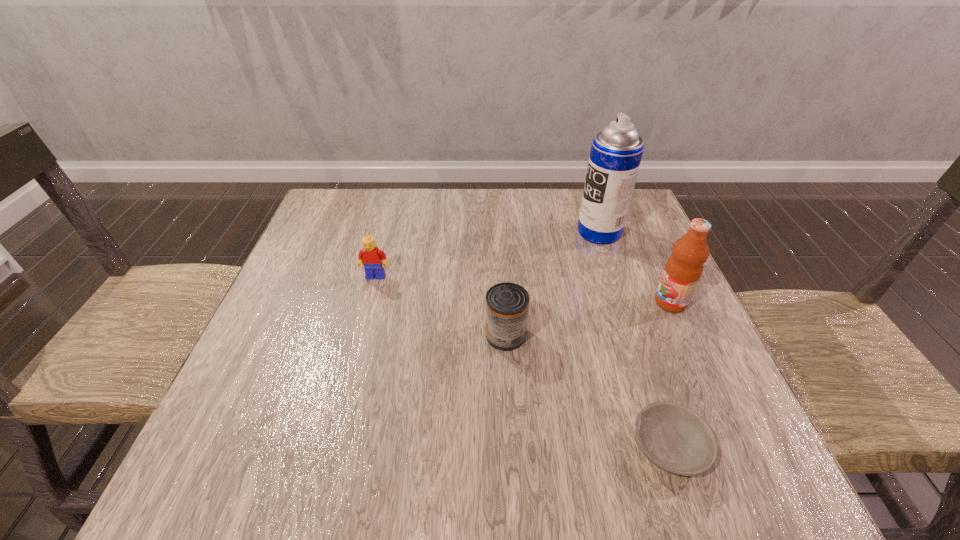
You are a GUI agent. You are given a task and a screenshot of the screen. Output one action in this format:
    pyautogui.click(x=<x>, y=<y>)
    Task: Click on the tallest object
    This screenshot has height=540, width=960.
    Given the screenshot: What is the action you would take?
    pyautogui.click(x=616, y=152)

Identify the location of aerosol can. (616, 152).

Where is `the fourth shortest object`? The image size is (960, 540). the fourth shortest object is located at coordinates (682, 272).

Where is `the third nearest object`? Image resolution: width=960 pixels, height=540 pixels. the third nearest object is located at coordinates (682, 272).

This screenshot has height=540, width=960. Identify the location of Lego. (370, 257).

Locate an element on the screen. Image resolution: width=960 pixels, height=540 pixels. the leftmost object is located at coordinates (370, 257).

Where is `the fourth object from right to left`? the fourth object from right to left is located at coordinates (507, 304).

This screenshot has width=960, height=540. What are the coordinates of `the second nearest object` in the screenshot? It's located at (507, 304).

What are the coordinates of `the nearest object` in the screenshot? It's located at (674, 438).

The width and height of the screenshot is (960, 540). In order to click on the shortest object in this screenshot , I will do `click(674, 438)`.